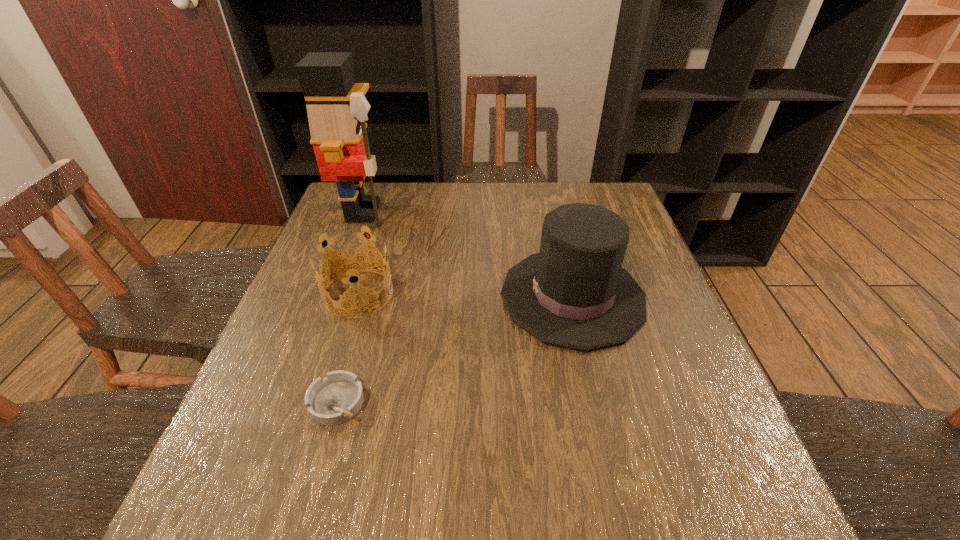
Locate an element on the screen. nutcracker is located at coordinates (337, 109).

What are the coordinates of `the tallest object` in the screenshot? It's located at (337, 109).

The image size is (960, 540). I want to click on the third shortest object, so click(574, 293).

Locate an element on the screen. This screenshot has height=540, width=960. the rightmost object is located at coordinates (574, 293).

Where is `the third tallest object`? The width and height of the screenshot is (960, 540). the third tallest object is located at coordinates (350, 263).

Find the location of a particular element. the nearest object is located at coordinates (337, 398).

Where is `the shortest object`? the shortest object is located at coordinates (337, 398).

The width and height of the screenshot is (960, 540). I want to click on vacant space situated 0.330m in front of the tallest object holding the staff, so click(x=499, y=212).

You are a GUI agent. You are given a task and a screenshot of the screen. Output one action in this format:
    pyautogui.click(x=<x>, y=<y>)
    Task: Click on the vacant space located 0.110m on the front of the rightmost object with the decoration
    This screenshot has width=960, height=540.
    Given the screenshot: What is the action you would take?
    pyautogui.click(x=455, y=296)

Identify the location of free location located on the front of the rightmost object with the decoration. (446, 296).